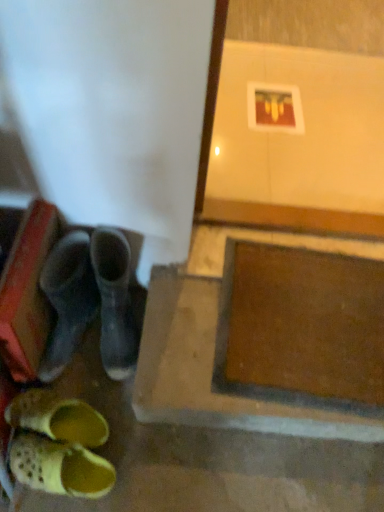
Question: Could you tell me if yellow mesh clog at lower left is turned towards brown matte concrete at lower right?

Choices:
 (A) no
 (B) yes

Answer: (A)

Question: Is brown matte concrete at lower right a part of yellow mesh clog at lower left?

Choices:
 (A) yes
 (B) no

Answer: (B)

Question: Considering the relative sizes of yellow mesh clog at lower left and brown matte concrete at lower right in the image provided, is yellow mesh clog at lower left wider than brown matte concrete at lower right?

Choices:
 (A) no
 (B) yes

Answer: (A)

Question: Considering the relative sizes of yellow mesh clog at lower left and brown matte concrete at lower right in the image provided, is yellow mesh clog at lower left thinner than brown matte concrete at lower right?

Choices:
 (A) no
 (B) yes

Answer: (B)

Question: From a real-world perspective, is yellow mesh clog at lower left positioned over brown matte concrete at lower right based on gravity?

Choices:
 (A) no
 (B) yes

Answer: (A)

Question: From a real-world perspective, is yellow mesh clog at lower left positioned under brown matte concrete at lower right based on gravity?

Choices:
 (A) yes
 (B) no

Answer: (A)

Question: Is brown matte concrete at lower right taller than yellow mesh clog at lower left?

Choices:
 (A) no
 (B) yes

Answer: (B)

Question: Is brown matte concrete at lower right facing away from yellow mesh clog at lower left?

Choices:
 (A) no
 (B) yes

Answer: (A)

Question: Considering the relative sizes of brown matte concrete at lower right and yellow mesh clog at lower left in the image provided, is brown matte concrete at lower right shorter than yellow mesh clog at lower left?

Choices:
 (A) no
 (B) yes

Answer: (A)

Question: Are brown matte concrete at lower right and yellow mesh clog at lower left beside each other?

Choices:
 (A) yes
 (B) no

Answer: (B)

Question: Is brown matte concrete at lower right far from yellow mesh clog at lower left?

Choices:
 (A) yes
 (B) no

Answer: (B)

Question: Is yellow mesh clog at lower left completely or partially inside brown matte concrete at lower right?

Choices:
 (A) no
 (B) yes

Answer: (A)

Question: From the image's perspective, is yellow mesh clog at lower left positioned above or below brown matte concrete at lower right?

Choices:
 (A) above
 (B) below

Answer: (B)